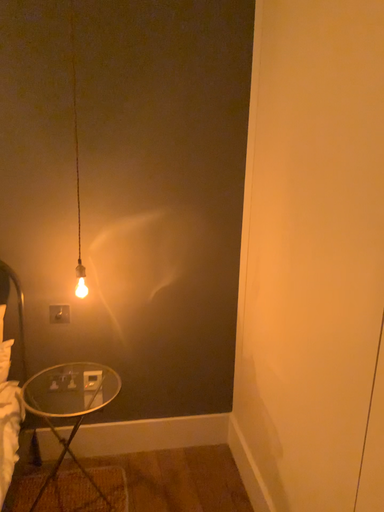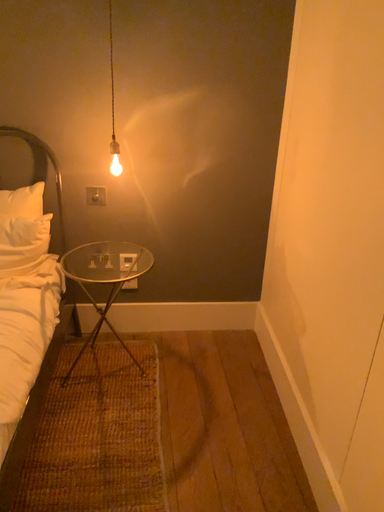
Question: How did the camera likely rotate when shooting the video?

Choices:
 (A) rotated downward
 (B) rotated upward

Answer: (A)